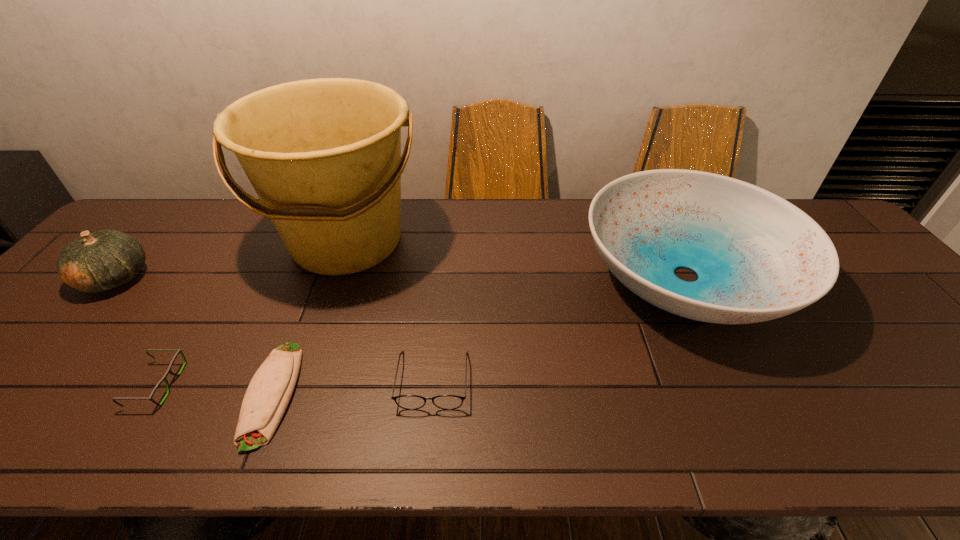
Where is `vacant space that satisfies the following two spatial constraints: 1. on the front-facing side of the taller spectacles; 2. on the lens of the shorter spectacles`? vacant space that satisfies the following two spatial constraints: 1. on the front-facing side of the taller spectacles; 2. on the lens of the shorter spectacles is located at coordinates (433, 384).

This screenshot has height=540, width=960. I want to click on free region that satisfies the following two spatial constraints: 1. on the front-facing side of the taller spectacles; 2. on the lens of the left spectacles, so click(x=433, y=384).

Locate an element on the screen. Image resolution: width=960 pixels, height=540 pixels. free point that satisfies the following two spatial constraints: 1. on the side of the bucket with the handle; 2. on the lens of the shorter spectacles is located at coordinates (298, 384).

At what (x,y) coordinates should I click in order to perform the action: click on vacant space that satisfies the following two spatial constraints: 1. on the back side of the rightmost object; 2. on the left side of the gourd. Please return your answer as a coordinate pair (x, y). Looking at the image, I should click on (118, 276).